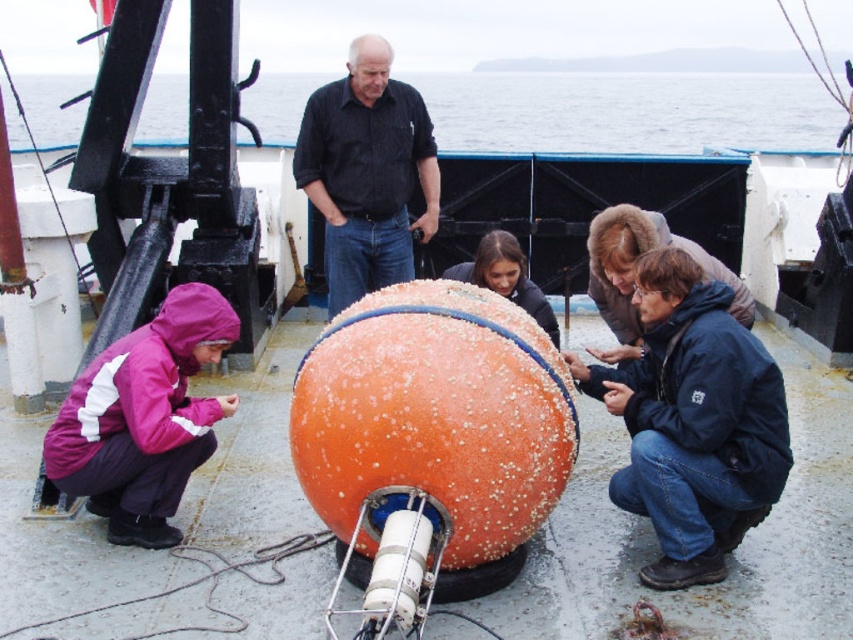
Does point (111, 403) lie behind point (466, 268)?

No.

Looking at this image, is the position of pink fabric jacket at lower left less distant than that of orange rubber buoy at center?

Yes, it is.

Which is in front, point (170, 536) or point (488, 275)?

Point (170, 536) is in front.

The image size is (853, 640). I want to click on pink fabric jacket at lower left, so click(143, 419).

Is point (305, 109) positioned after point (465, 269)?

Yes, point (305, 109) is farther from viewer.

This screenshot has height=640, width=853. In order to click on black striped shirt at upper center in this screenshot , I will do `click(366, 172)`.

Locate an element on the screen. black striped shirt at upper center is located at coordinates (366, 172).

Between pink fabric jacket at lower left and black striped shirt at upper center, which one appears on the left side from the viewer's perspective?

From the viewer's perspective, pink fabric jacket at lower left appears more on the left side.

Can you confirm if pink fabric jacket at lower left is positioned to the left of black striped shirt at upper center?

Yes, pink fabric jacket at lower left is to the left of black striped shirt at upper center.

Who is more distant from viewer, (99, 364) or (392, 148)?

The point (392, 148) is more distant.

Where is `pink fabric jacket at lower left`? pink fabric jacket at lower left is located at coordinates (143, 419).